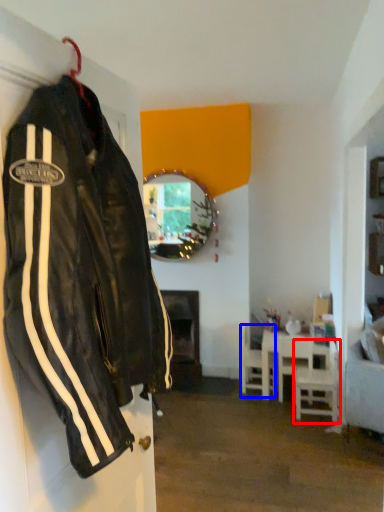
Question: Among these objects, which one is nearest to the camera, chair (highlighted by a red box) or chair (highlighted by a blue box)?

Choices:
 (A) chair
 (B) chair

Answer: (A)